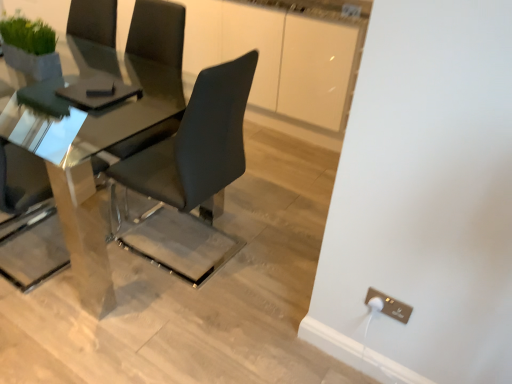
Question: Can you confirm if matte black chair at center is shorter than metallic gold electrical outlet at lower right?

Choices:
 (A) no
 (B) yes

Answer: (A)

Question: Can you confirm if matte black chair at center is positioned to the left of metallic gold electrical outlet at lower right?

Choices:
 (A) no
 (B) yes

Answer: (B)

Question: Is matte black chair at center not inside metallic gold electrical outlet at lower right?

Choices:
 (A) yes
 (B) no

Answer: (A)

Question: Is matte black chair at center at the right side of metallic gold electrical outlet at lower right?

Choices:
 (A) yes
 (B) no

Answer: (B)

Question: From the image's perspective, is matte black chair at center under metallic gold electrical outlet at lower right?

Choices:
 (A) no
 (B) yes

Answer: (A)

Question: In the image, is polished glass table at center positioned in front of or behind matte black chair at center?

Choices:
 (A) behind
 (B) front

Answer: (A)

Question: From a real-world perspective, is polished glass table at center above or below matte black chair at center?

Choices:
 (A) above
 (B) below

Answer: (B)

Question: Considering the relative positions of polished glass table at center and matte black chair at center in the image provided, is polished glass table at center to the left or to the right of matte black chair at center?

Choices:
 (A) right
 (B) left

Answer: (B)

Question: Is polished glass table at center taller or shorter than matte black chair at center?

Choices:
 (A) tall
 (B) short

Answer: (B)

Question: From the image's perspective, relative to metallic gold electrical outlet at lower right, is polished glass table at center above or below?

Choices:
 (A) below
 (B) above

Answer: (B)

Question: Considering the positions of polished glass table at center and metallic gold electrical outlet at lower right in the image, is polished glass table at center taller or shorter than metallic gold electrical outlet at lower right?

Choices:
 (A) short
 (B) tall

Answer: (B)

Question: Considering the positions of polished glass table at center and metallic gold electrical outlet at lower right in the image, is polished glass table at center bigger or smaller than metallic gold electrical outlet at lower right?

Choices:
 (A) small
 (B) big

Answer: (B)

Question: Does point (65, 46) appear closer or farther from the camera than point (408, 311)?

Choices:
 (A) farther
 (B) closer

Answer: (A)

Question: From the image's perspective, relative to metallic gold electrical outlet at lower right, is matte black chair at center above or below?

Choices:
 (A) above
 (B) below

Answer: (A)

Question: Considering the relative positions of matte black chair at center and metallic gold electrical outlet at lower right in the image provided, is matte black chair at center to the left or to the right of metallic gold electrical outlet at lower right?

Choices:
 (A) right
 (B) left

Answer: (B)